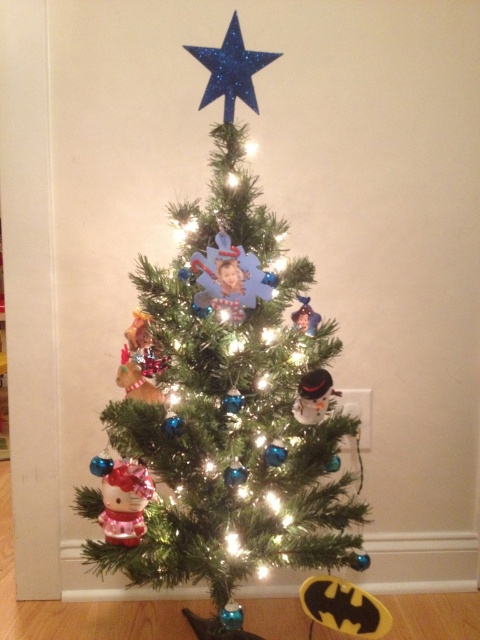
Between green matte christmas tree at center and frosted glass snowman at center, which one has less height?

With less height is frosted glass snowman at center.

Does point (330, 324) come behind point (317, 374)?

Yes, it is.

Describe the element at coordinates (230, 394) in the screenshot. I see `green matte christmas tree at center` at that location.

Where is `green matte christmas tree at center`? The width and height of the screenshot is (480, 640). green matte christmas tree at center is located at coordinates (230, 394).

Is point (148, 380) in front of point (290, 316)?

That is False.

Which is more to the right, shiny gold ornament at center-left or metallic silver ornament at center?

metallic silver ornament at center

Image resolution: width=480 pixels, height=640 pixels. I want to click on shiny gold ornament at center-left, so click(136, 380).

I want to click on shiny gold ornament at center-left, so click(x=136, y=380).

Can you confirm if glittery blue star at top is positioned above metallic silver ornament at center?

Correct, glittery blue star at top is located above metallic silver ornament at center.

Measure the distance between glittery blue star at top and metallic silver ornament at center.

24.89 inches

Between point (252, 51) and point (312, 332), which one is positioned in front?

Point (312, 332) is in front.

I want to click on glittery blue star at top, so click(230, 68).